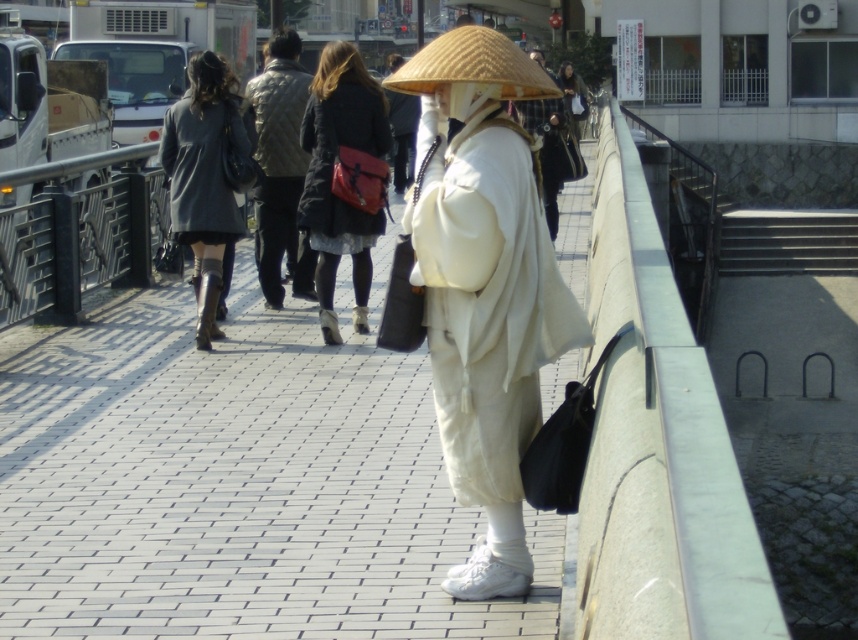
Question: Which point is farther to the camera?

Choices:
 (A) white matte kimono at center
 (B) matte gray coat at center
 (C) white matte robe at center
 (D) natural straw hat at center

Answer: (B)

Question: Which is farther from the white matte robe at center?

Choices:
 (A) matte gray coat at center
 (B) matte black bag at center
 (C) natural straw hat at center
 (D) white matte kimono at center

Answer: (C)

Question: Can you confirm if natural straw hat at center is positioned above white matte robe at center?

Choices:
 (A) yes
 (B) no

Answer: (B)

Question: Is matte gray coat at center smaller than white matte robe at center?

Choices:
 (A) yes
 (B) no

Answer: (A)

Question: Does matte beige vest at center have a larger size compared to matte black bag at center?

Choices:
 (A) yes
 (B) no

Answer: (B)

Question: Which object is the farthest from the matte black coat at center?

Choices:
 (A) matte beige vest at center
 (B) white matte robe at center
 (C) matte gray coat at center

Answer: (B)